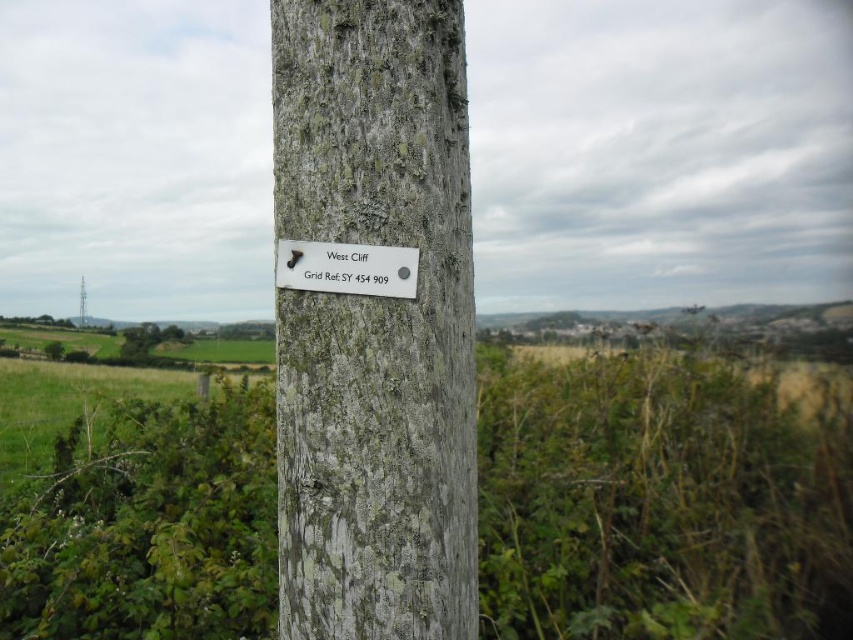
Does lichen-covered wood at center appear over white plastic sign at center?

Actually, lichen-covered wood at center is below white plastic sign at center.

Is point (352, 22) closer to camera compared to point (335, 276)?

That is False.

Image resolution: width=853 pixels, height=640 pixels. What are the coordinates of `lichen-covered wood at center` in the screenshot? It's located at (375, 323).

Does white plastic sign at center appear on the left side of green rough bark tree at lower left?

No, white plastic sign at center is not to the left of green rough bark tree at lower left.

Where is `white plastic sign at center`? The image size is (853, 640). white plastic sign at center is located at coordinates (346, 268).

Image resolution: width=853 pixels, height=640 pixels. What are the coordinates of `white plastic sign at center` in the screenshot? It's located at (346, 268).

Which is above, lichen-covered wood at center or gray rough bark tree at center?

lichen-covered wood at center is higher up.

Measure the distance from lichen-covered wood at center to gray rough bark tree at center.

They are 22.44 feet apart.

Who is more forward, (x=456, y=51) or (x=49, y=358)?

Point (x=456, y=51)

Image resolution: width=853 pixels, height=640 pixels. I want to click on lichen-covered wood at center, so click(x=375, y=323).